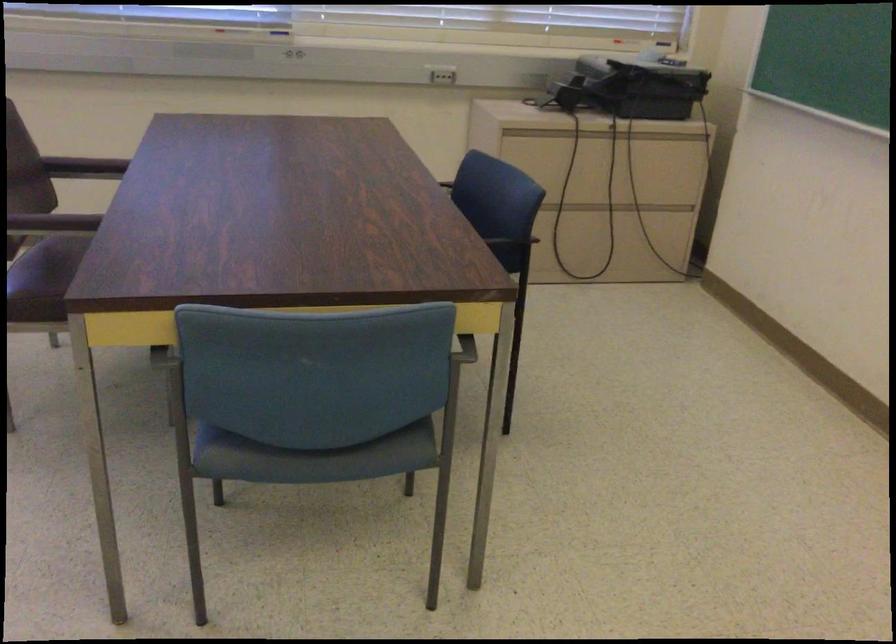
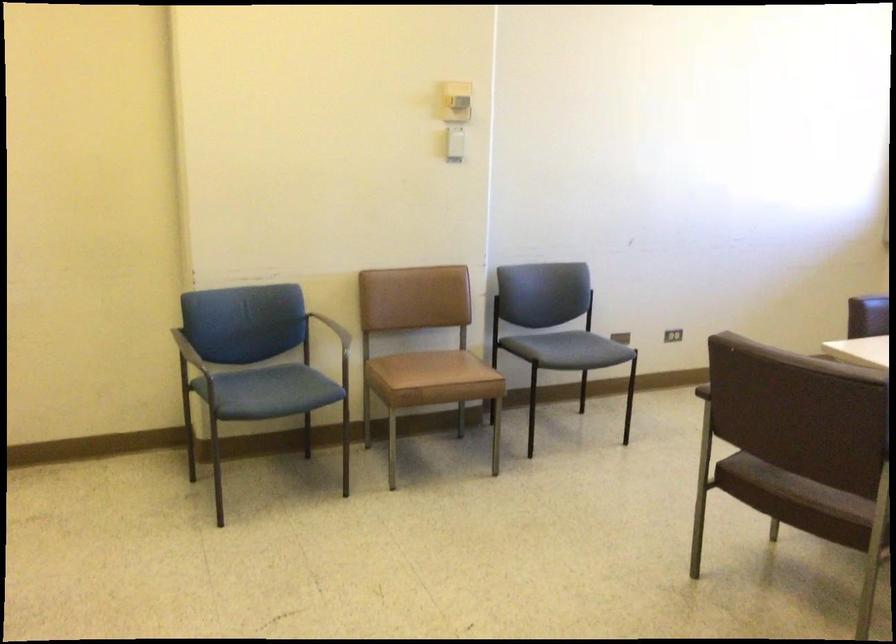
Question: The camera is either moving clockwise (left) or counter-clockwise (right) around the object. The first image is from the beginning of the video and the second image is from the end. Is the camera moving left or right when shooting the video?

Choices:
 (A) Left
 (B) Right

Answer: (B)